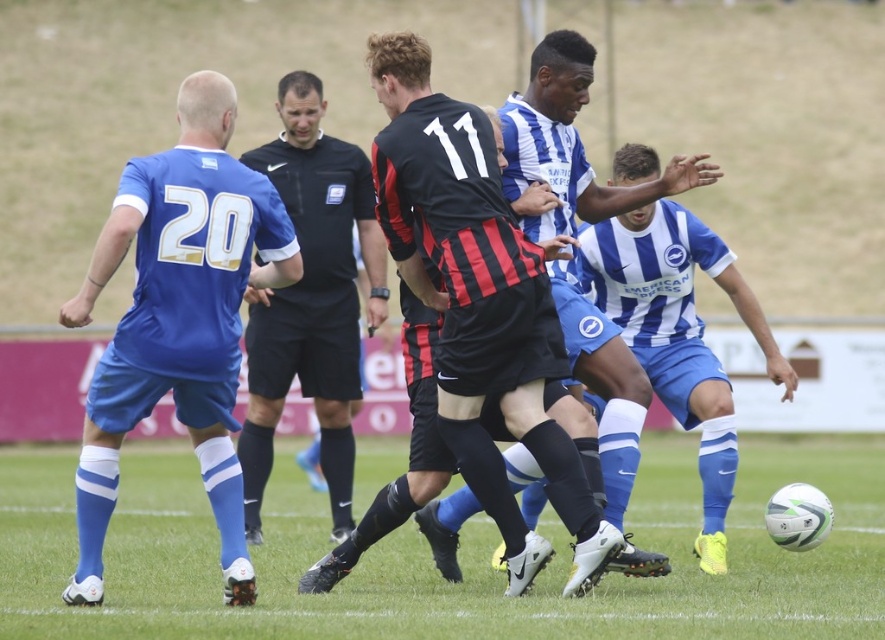
Question: Among these points, which one is farthest from the camera?

Choices:
 (A) tap(268, 145)
 (B) tap(295, 557)

Answer: (A)

Question: Can you confirm if black/smooth shirt at center is thinner than blue striped jersey at center?

Choices:
 (A) yes
 (B) no

Answer: (B)

Question: Which point appears farthest from the camera in this image?

Choices:
 (A) (568, 154)
 (B) (340, 337)
 (C) (226, 412)
 (D) (412, 600)

Answer: (B)

Question: Where is matte blue jersey at left located in relation to blue striped jersey at center in the image?

Choices:
 (A) above
 (B) below

Answer: (B)

Question: Which of these objects is positioned closest to the blue striped jersey at center?

Choices:
 (A) matte blue jersey at left
 (B) black/smooth shirt at center
 (C) white textured football at center

Answer: (A)

Question: Can you confirm if white textured football at center is bigger than matte blue jersey at left?

Choices:
 (A) no
 (B) yes

Answer: (B)